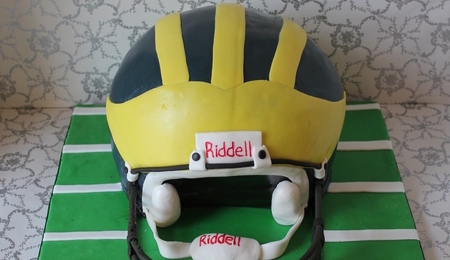
Find the location of a particular element. white sofa with gray flowers is located at coordinates (62, 40).